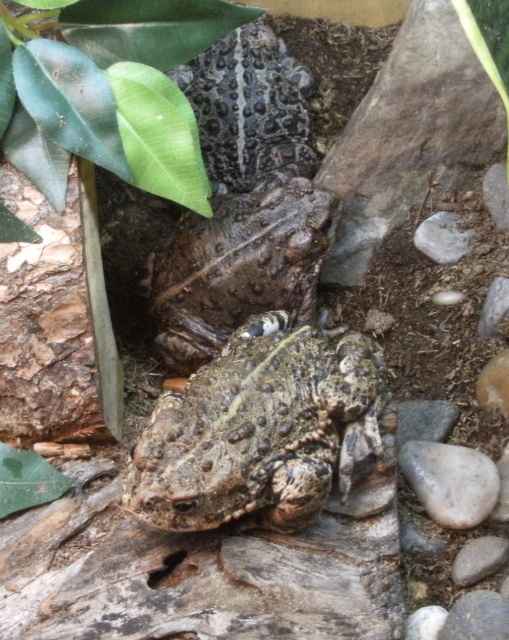
You are a biologist observing two frogs in a natural habitat. You notice a speckled brown frog at center and a speckled rough skin at center. Which of these two has a bigger size?

The speckled brown frog at center has a larger size compared to the speckled rough skin at center.

You are an entomologist observing two features in the image. You see the green matte leaf at upper left and the spotted brown skin at center. Which of these two objects is larger in size?

The green matte leaf at upper left is bigger than the spotted brown skin at center according to the description.